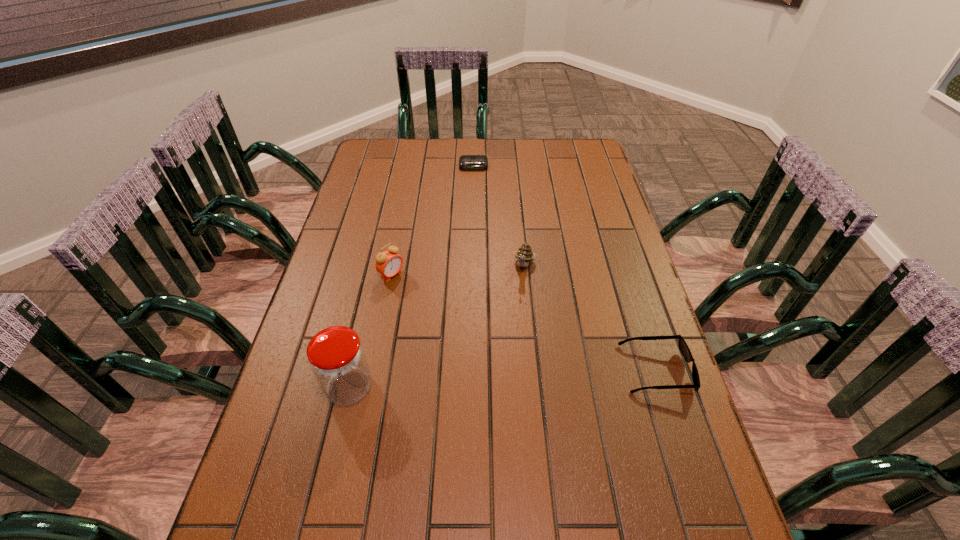
Find the location of `vacant space on the desktop that is between the tallest object and the rightmost object and is positioned on the face of the second object from right to left`. vacant space on the desktop that is between the tallest object and the rightmost object and is positioned on the face of the second object from right to left is located at coordinates (492, 380).

You are a GUI agent. You are given a task and a screenshot of the screen. Output one action in this format:
    pyautogui.click(x=<x>, y=<y>)
    Task: Click on the free space on the desktop that is between the jar and the rightmost object and is positioned on the display of the farthest object
    The height and width of the screenshot is (540, 960).
    Given the screenshot: What is the action you would take?
    pyautogui.click(x=473, y=381)

This screenshot has height=540, width=960. Identify the location of free space on the desktop that is between the jar and the sunglasses and is positioned on the face of the left alarm clock. (533, 377).